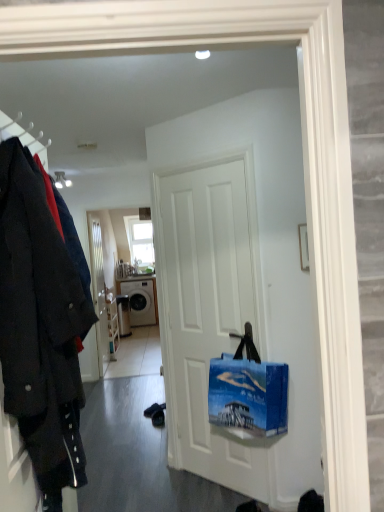
You are a GUI agent. You are given a task and a screenshot of the screen. Output one action in this format:
    pyautogui.click(x=<x>, y=<y>)
    Task: Click on the vacant space situated on the left part of white matte door at center, acting as the 1th door starting from the front
    
    Given the screenshot: What is the action you would take?
    pyautogui.click(x=149, y=484)